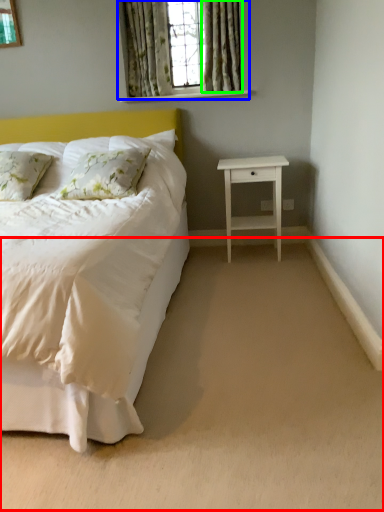
Question: Which is farther away from plain (highlighted by a red box)? window (highlighted by a blue box) or curtain (highlighted by a green box)?

Choices:
 (A) window
 (B) curtain

Answer: (A)